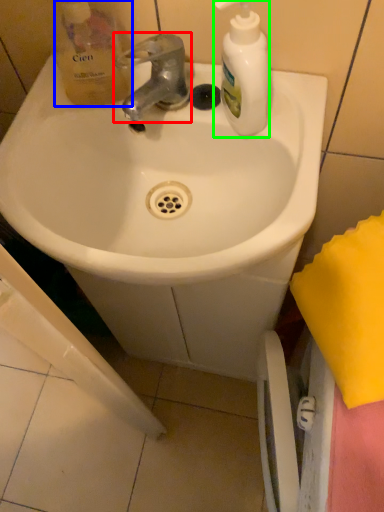
Question: Considering the real-world distances, which object is closest to tap (highlighted by a red box)? product (highlighted by a blue box) or cleaning product (highlighted by a green box).

Choices:
 (A) product
 (B) cleaning product

Answer: (A)